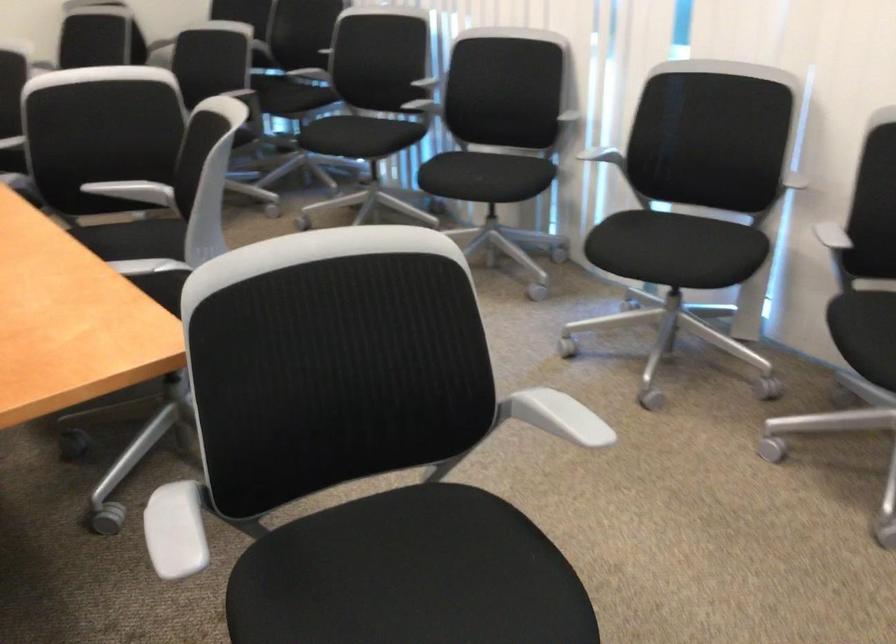
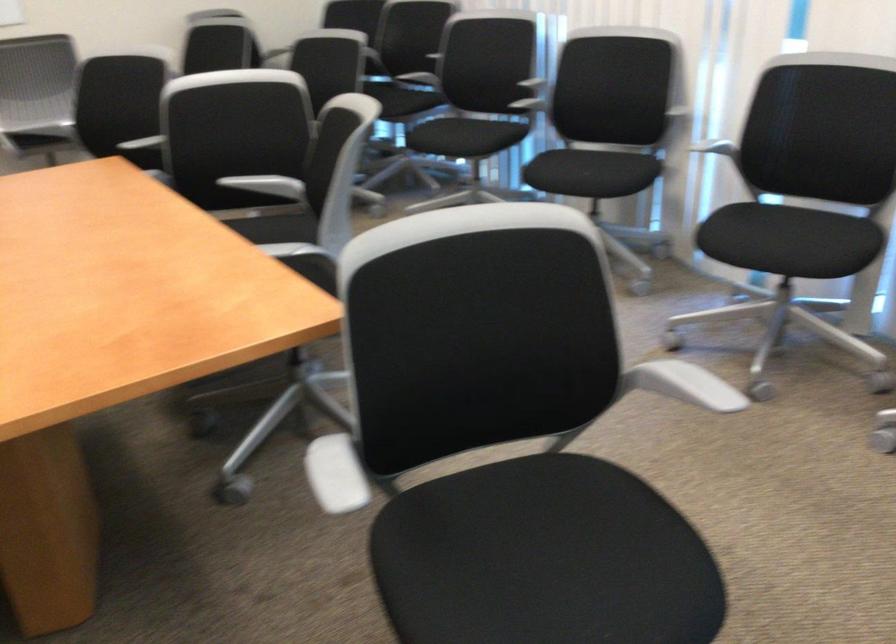
Locate, in the second image, the point that corresponds to point 563,413 in the first image.

(682, 384)